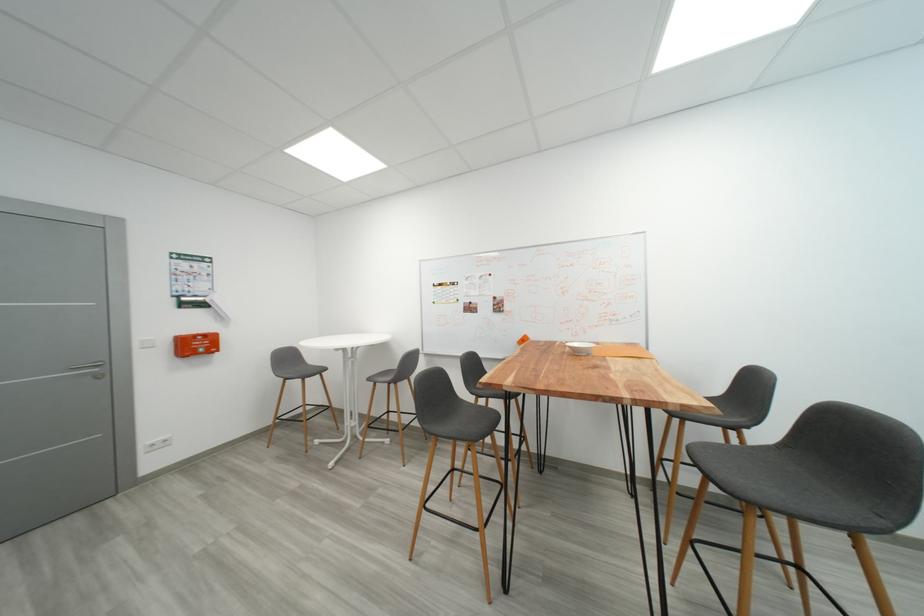
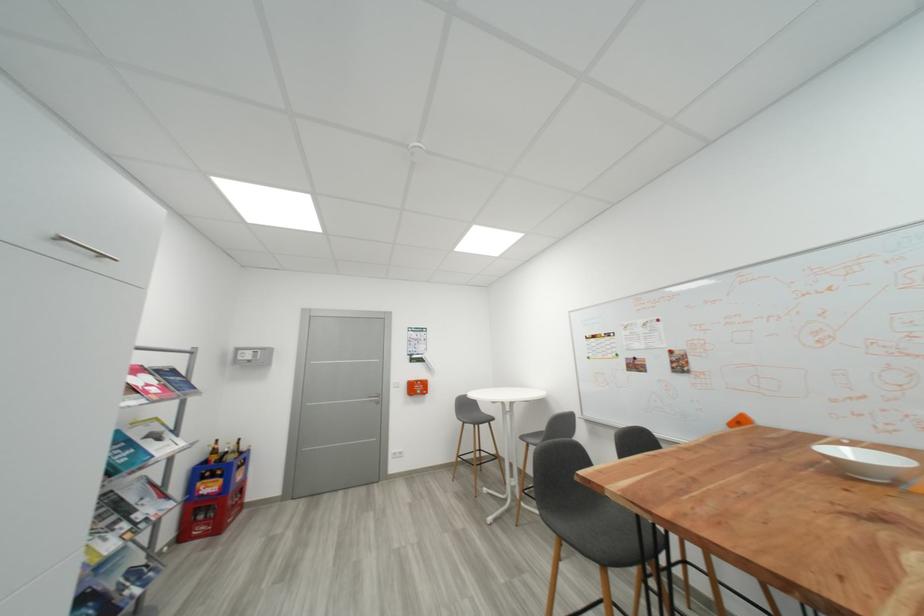
Find the pixel in the second image that matches point 578,350 in the first image.

(834, 458)